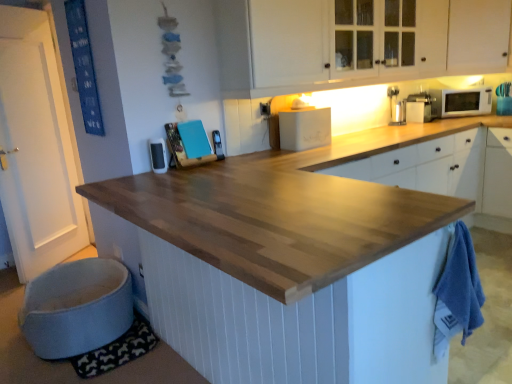
Question: From the image's perspective, would you say white glossy microwave at upper right is positioned over natural wood countertop at center?

Choices:
 (A) yes
 (B) no

Answer: (A)

Question: Would you say white glossy microwave at upper right contains natural wood countertop at center?

Choices:
 (A) yes
 (B) no

Answer: (B)

Question: Considering the relative positions of white glossy microwave at upper right and natural wood countertop at center in the image provided, is white glossy microwave at upper right to the right of natural wood countertop at center from the viewer's perspective?

Choices:
 (A) yes
 (B) no

Answer: (A)

Question: Is white glossy microwave at upper right wider than natural wood countertop at center?

Choices:
 (A) yes
 (B) no

Answer: (B)

Question: Is white glossy microwave at upper right oriented towards natural wood countertop at center?

Choices:
 (A) no
 (B) yes

Answer: (A)

Question: Is natural wood countertop at center inside or outside of metallic silver phone at center, the second appliance from the left?

Choices:
 (A) outside
 (B) inside

Answer: (A)

Question: Considering the positions of natural wood countertop at center and metallic silver phone at center, which is the 3th appliance from right to left, in the image, is natural wood countertop at center taller or shorter than metallic silver phone at center, which is the 3th appliance from right to left,?

Choices:
 (A) tall
 (B) short

Answer: (A)

Question: In terms of width, does natural wood countertop at center look wider or thinner when compared to metallic silver phone at center, the second appliance from the left?

Choices:
 (A) wide
 (B) thin

Answer: (A)

Question: From a real-world perspective, is natural wood countertop at center physically located above or below metallic silver phone at center, which is counted as the 3th appliance, starting from the back?

Choices:
 (A) below
 (B) above

Answer: (A)

Question: Is natural wood countertop at center bigger or smaller than white matte cabinet at upper right, which is the first cabinetry in right-to-left order?

Choices:
 (A) big
 (B) small

Answer: (A)

Question: From the image's perspective, is natural wood countertop at center positioned above or below white matte cabinet at upper right, which is the first cabinetry in right-to-left order?

Choices:
 (A) above
 (B) below

Answer: (B)

Question: From a real-world perspective, relative to white matte cabinet at upper right, which appears as the second cabinetry when viewed from the left, is natural wood countertop at center vertically above or below?

Choices:
 (A) below
 (B) above

Answer: (A)

Question: Is natural wood countertop at center spatially inside white matte cabinet at upper right, which is the first cabinetry in right-to-left order, or outside of it?

Choices:
 (A) outside
 (B) inside

Answer: (A)

Question: Looking at their shapes, would you say white glossy microwave at upper right is wider or thinner than white matte breadbox at upper center, which is the 3th appliance in front-to-back order?

Choices:
 (A) thin
 (B) wide

Answer: (A)

Question: From the image's perspective, is white glossy microwave at upper right above or below white matte breadbox at upper center, which is the 3th appliance in front-to-back order?

Choices:
 (A) above
 (B) below

Answer: (A)